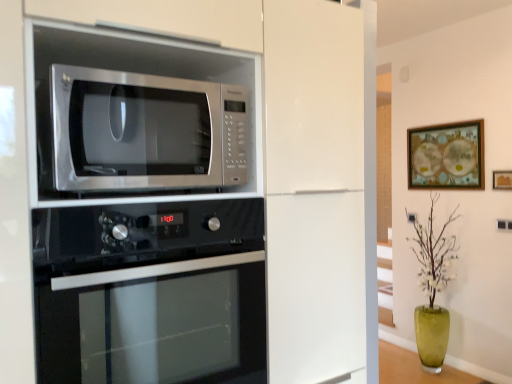
Question: Does black glass oven at lower center turn towards wooden framed artwork at upper right, the 2th picture frame from the right?

Choices:
 (A) yes
 (B) no

Answer: (B)

Question: Is black glass oven at lower center far from wooden framed artwork at upper right, which is the first picture frame from back to front?

Choices:
 (A) no
 (B) yes

Answer: (B)

Question: Is black glass oven at lower center at the left side of wooden framed artwork at upper right, which is counted as the second picture frame, starting from the front?

Choices:
 (A) no
 (B) yes

Answer: (B)

Question: Can you confirm if black glass oven at lower center is taller than wooden framed artwork at upper right, which is counted as the second picture frame, starting from the front?

Choices:
 (A) yes
 (B) no

Answer: (A)

Question: Considering the relative sizes of black glass oven at lower center and wooden framed artwork at upper right, acting as the first picture frame starting from the left, in the image provided, is black glass oven at lower center smaller than wooden framed artwork at upper right, acting as the first picture frame starting from the left,?

Choices:
 (A) yes
 (B) no

Answer: (B)

Question: Does black glass oven at lower center come in front of wooden framed artwork at upper right, the 2th picture frame from the right?

Choices:
 (A) yes
 (B) no

Answer: (A)

Question: Does wooden framed artwork at upper right, acting as the first picture frame starting from the left, have a lesser width compared to black glass oven at lower center?

Choices:
 (A) yes
 (B) no

Answer: (A)

Question: From the image's perspective, is wooden framed artwork at upper right, which is counted as the second picture frame, starting from the front, below black glass oven at lower center?

Choices:
 (A) yes
 (B) no

Answer: (B)

Question: From a real-world perspective, is wooden framed artwork at upper right, acting as the first picture frame starting from the left, beneath black glass oven at lower center?

Choices:
 (A) yes
 (B) no

Answer: (B)

Question: Is wooden framed artwork at upper right, which is the first picture frame from back to front, not inside black glass oven at lower center?

Choices:
 (A) yes
 (B) no

Answer: (A)

Question: Can you confirm if wooden framed artwork at upper right, the 2th picture frame from the right, is smaller than black glass oven at lower center?

Choices:
 (A) yes
 (B) no

Answer: (A)

Question: Is wooden framed artwork at upper right, the 2th picture frame from the right, next to black glass oven at lower center and touching it?

Choices:
 (A) no
 (B) yes

Answer: (A)

Question: From a real-world perspective, does stainless steel microwave at upper left sit lower than black glass oven at lower center?

Choices:
 (A) yes
 (B) no

Answer: (B)